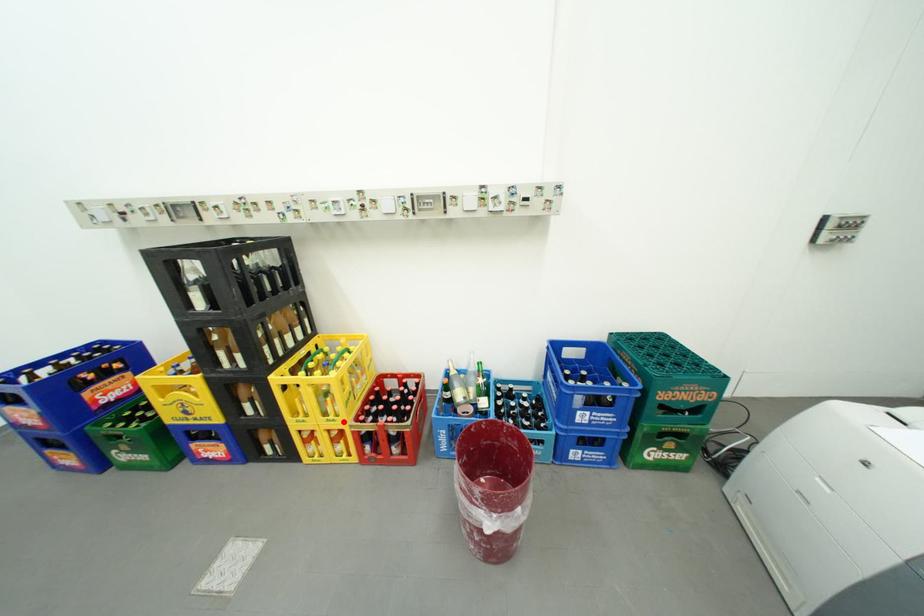
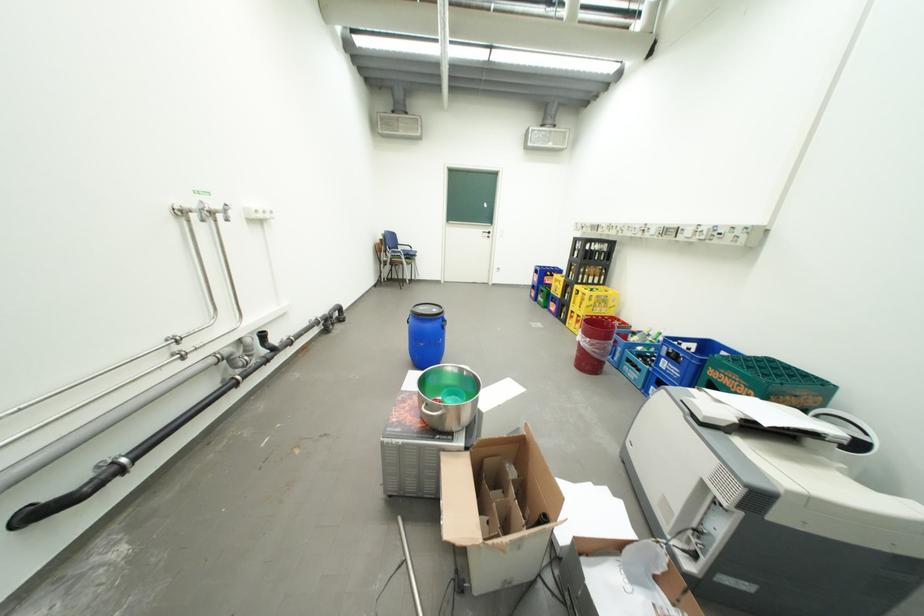
Find the pixel in the second image that matches the highlighted location in the first image.

(590, 312)